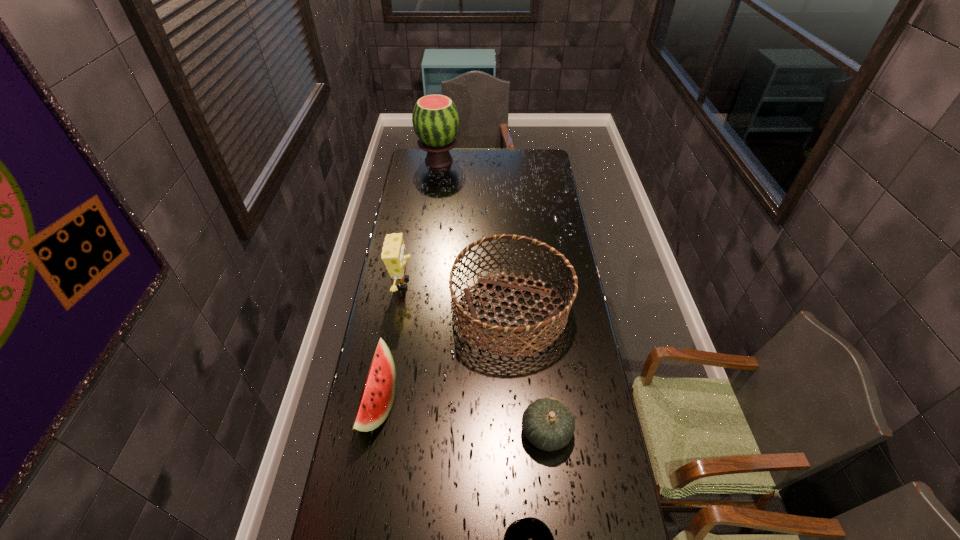
Where is `the farthest object`? This screenshot has height=540, width=960. the farthest object is located at coordinates (435, 118).

This screenshot has height=540, width=960. Find the location of `the tallest object`. the tallest object is located at coordinates (435, 118).

Identify the location of sponge. (393, 255).

At what (x,y) coordinates should I click in order to perform the action: click on basket. Please return your answer as a coordinate pair (x, y). The width and height of the screenshot is (960, 540). Looking at the image, I should click on (554, 315).

Locate an element on the screen. the nearer watermelon is located at coordinates (378, 394).

Find the location of a particular element. This screenshot has width=960, height=540. the fourth tallest object is located at coordinates (378, 394).

This screenshot has width=960, height=540. Identify the location of gourd. (548, 424).

Identify the location of free space located on the right of the tallest object. (506, 161).

This screenshot has height=540, width=960. In order to click on free space located on the face of the sponge in this screenshot , I will do `click(496, 283)`.

You are a GUI agent. You are given a task and a screenshot of the screen. Output one action in this format:
    pyautogui.click(x=<x>, y=<y>)
    Task: Click on the vacant area situated 0.070m on the left of the basket
    The image size is (960, 540).
    Given the screenshot: What is the action you would take?
    [433, 313]